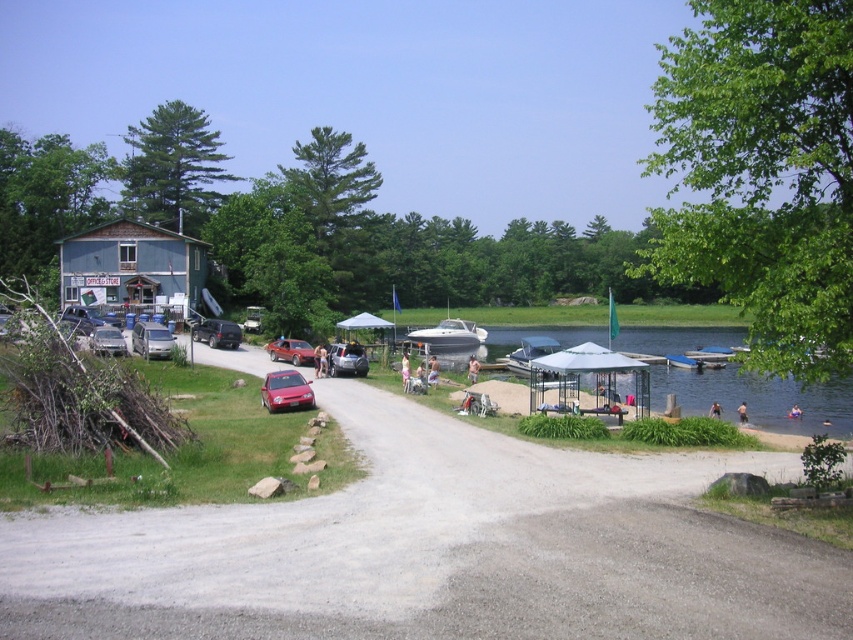
Question: Which object is the farthest from the satin silver sedan at center?

Choices:
 (A) shiny red car at center
 (B) matte black suv at center
 (C) clear blue water at lower right

Answer: (C)

Question: Observing the image, what is the correct spatial positioning of gray gravel driveway at center in reference to matte black suv at center?

Choices:
 (A) above
 (B) below

Answer: (B)

Question: Where is satin silver sedan at center located in relation to shiny red car at center in the image?

Choices:
 (A) left
 (B) right

Answer: (A)

Question: Estimate the real-world distances between objects in this image. Which object is farther from the white matte boat at center?

Choices:
 (A) matte black suv at center
 (B) metallic silver car at center-left
 (C) shiny red car at center
 (D) gray gravel driveway at center

Answer: (B)

Question: Considering the relative positions of clear blue water at lower right and white matte boat at center in the image provided, where is clear blue water at lower right located with respect to white matte boat at center?

Choices:
 (A) left
 (B) right

Answer: (B)

Question: Which object is farther from the camera taking this photo?

Choices:
 (A) matte red car at center
 (B) satin silver sedan at center
 (C) matte black suv at center
 (D) metallic silver car at center-left

Answer: (C)